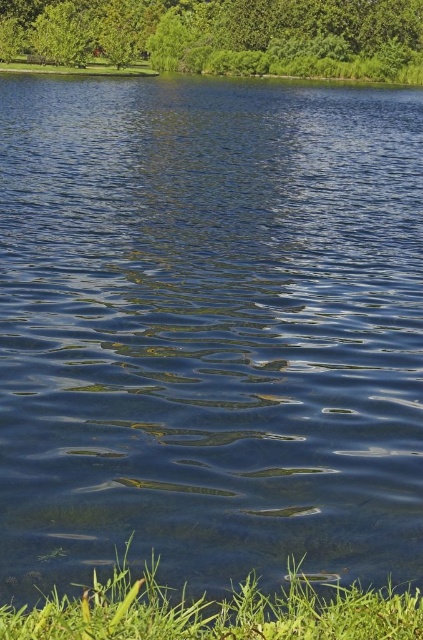
Question: Does green leafy tree at upper center come behind green grass at lower left?

Choices:
 (A) yes
 (B) no

Answer: (A)

Question: Can you confirm if green leafy tree at upper center is wider than green grass at lower left?

Choices:
 (A) no
 (B) yes

Answer: (B)

Question: Can you confirm if green leafy tree at upper center is smaller than green grass at lower left?

Choices:
 (A) no
 (B) yes

Answer: (A)

Question: Which point is closer to the camera?

Choices:
 (A) (154, 618)
 (B) (164, 22)

Answer: (A)